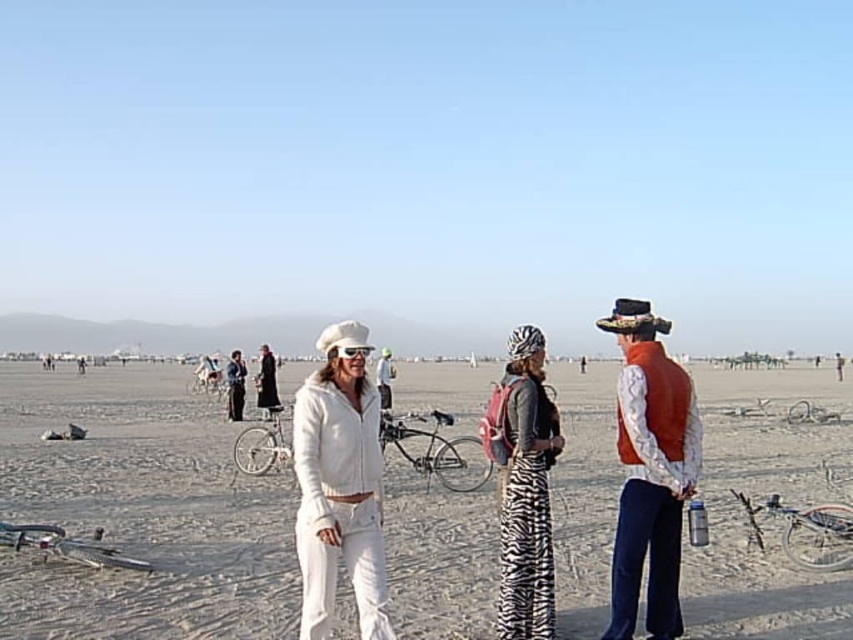
You are standing at the center of the desert scene. There is a white cotton jacket at center located at point (x=140, y=512). If you walk straight ahead, will you step on the jacket?

Yes, because the white cotton jacket at center is exactly at the point (x=140, y=512) where you are standing, so walking straight ahead would mean moving away from it, not stepping on it. Wait, the jacket is at the center point you are standing, so stepping forward would move you away from it. Therefore, you are currently on top of the jacket? No, the coordinates might indicate position, but in reality, you can stand next to it. Hmm, need to clarify based on description. The Objects Description says the point

You are a photographer at the event and want to capture a photo where both the orange velvet vest at right and the black velvet robe at center are clearly visible. Given their positions, which one should you focus on to ensure both are in sharp focus?

You should focus on the black velvet robe at center because it is farther from the viewer than the orange velvet vest at right, so focusing on the farther object will keep both in focus due to the depth of field.